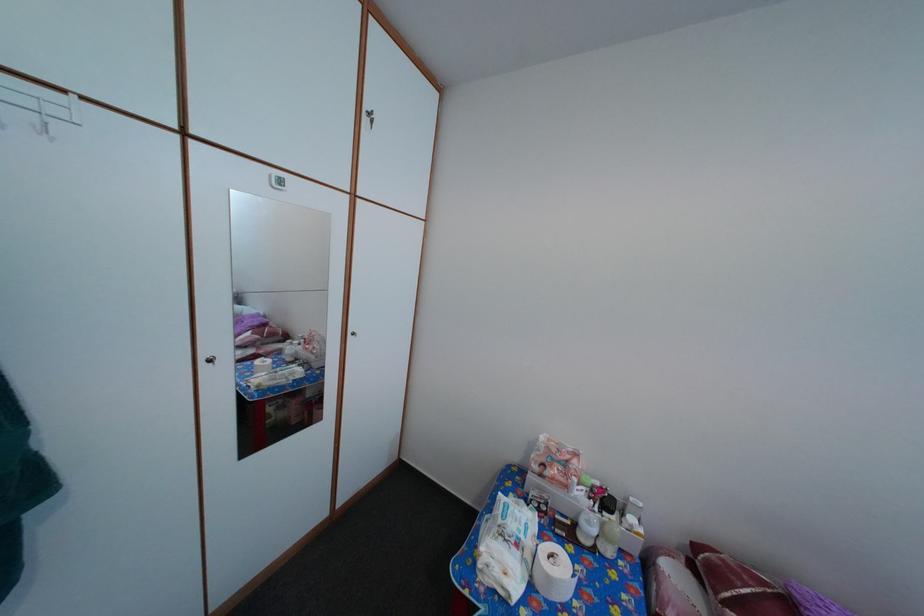
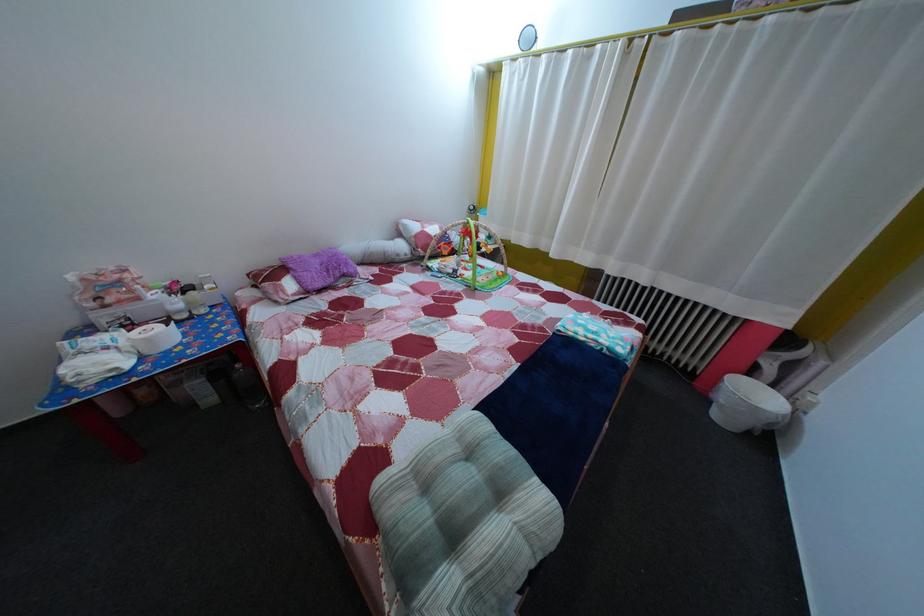
The point at (640, 527) is marked in the first image. Where is the corresponding point in the second image?

(216, 294)